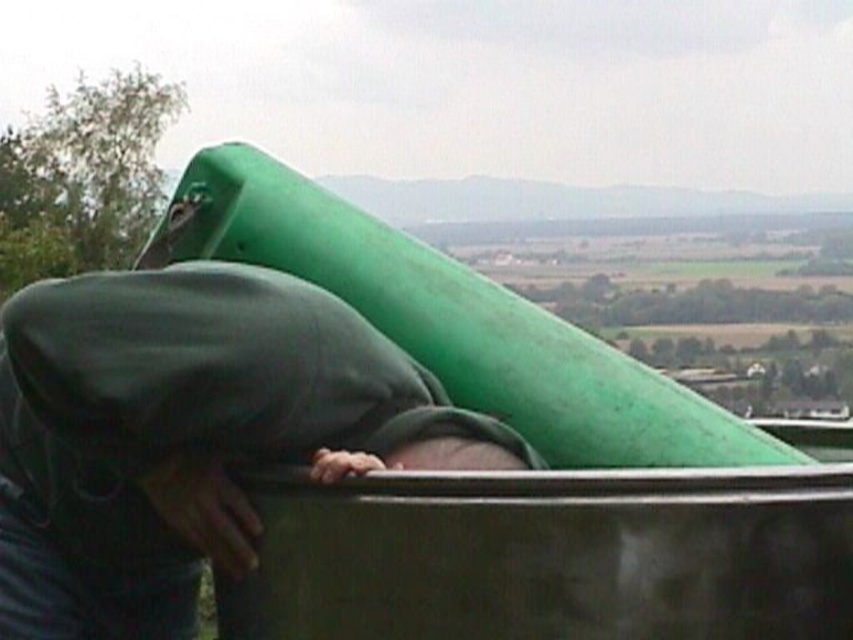
Question: Does dark green fabric at center have a greater width compared to green rubber slide at upper center?

Choices:
 (A) yes
 (B) no

Answer: (B)

Question: Does dark green fabric at center lie in front of green rubber slide at upper center?

Choices:
 (A) no
 (B) yes

Answer: (B)

Question: Does dark green fabric at center come in front of green rubber slide at upper center?

Choices:
 (A) no
 (B) yes

Answer: (B)

Question: Which point appears closest to the camera in this image?

Choices:
 (A) (276, 252)
 (B) (109, 417)

Answer: (B)